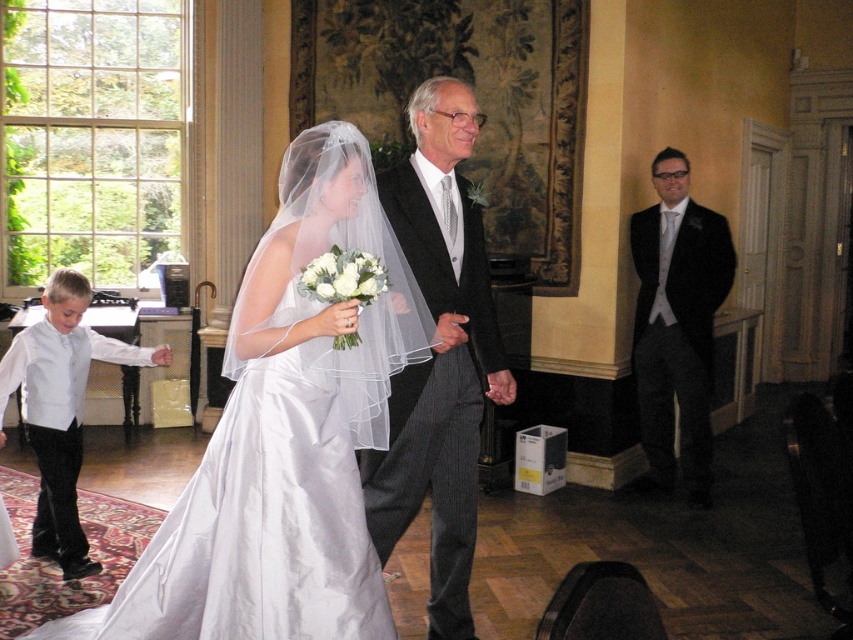
Is satin dress at center to the left of dark gray pinstripe suit at center from the viewer's perspective?

Correct, you'll find satin dress at center to the left of dark gray pinstripe suit at center.

In order to click on satin dress at center in this screenshot , I will do `click(285, 436)`.

Does satin dress at center have a greater width compared to matte black suit at right?

Indeed, satin dress at center has a greater width compared to matte black suit at right.

Is satin dress at center shorter than matte black suit at right?

Yes, satin dress at center is shorter than matte black suit at right.

Is point (250, 333) positioned behind point (709, 246)?

No, (250, 333) is closer to viewer.

Find the location of a particular element. The width and height of the screenshot is (853, 640). satin dress at center is located at coordinates (285, 436).

Which of these two, dark gray pinstripe suit at center or matte black suit at right, stands taller?

Standing taller between the two is dark gray pinstripe suit at center.

What do you see at coordinates (438, 355) in the screenshot? I see `dark gray pinstripe suit at center` at bounding box center [438, 355].

Which is behind, point (445, 140) or point (634, 224)?

The point (634, 224) is behind.

Image resolution: width=853 pixels, height=640 pixels. Identify the location of dark gray pinstripe suit at center. (438, 355).